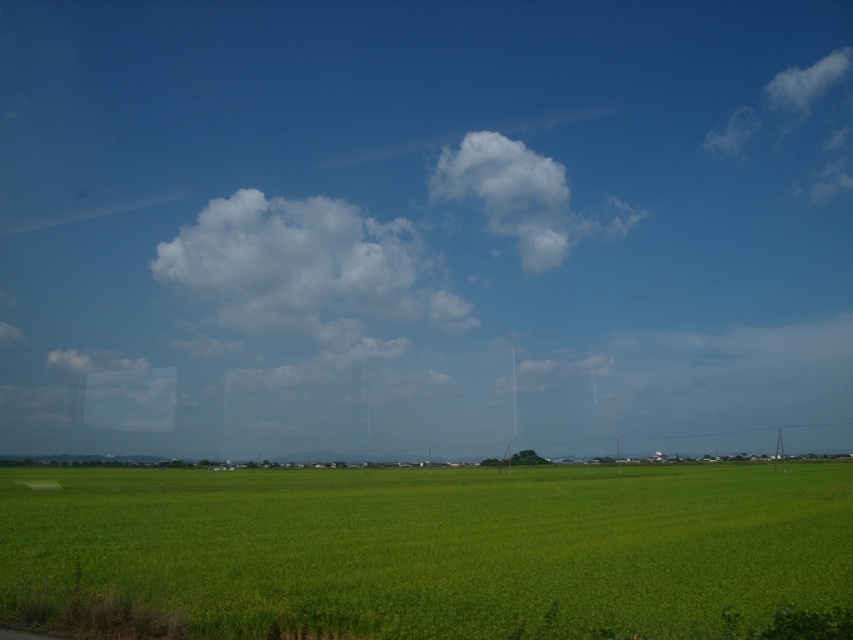
Who is shorter, green grass at lower center or white fluffy cloud at upper center?

With less height is green grass at lower center.

Between green grass at lower center and white fluffy cloud at upper center, which one is positioned lower?

green grass at lower center is lower down.

Who is more distant from viewer, [254,586] or [462,161]?

The point [462,161] is behind.

The height and width of the screenshot is (640, 853). In order to click on green grass at lower center in this screenshot , I will do `click(425, 550)`.